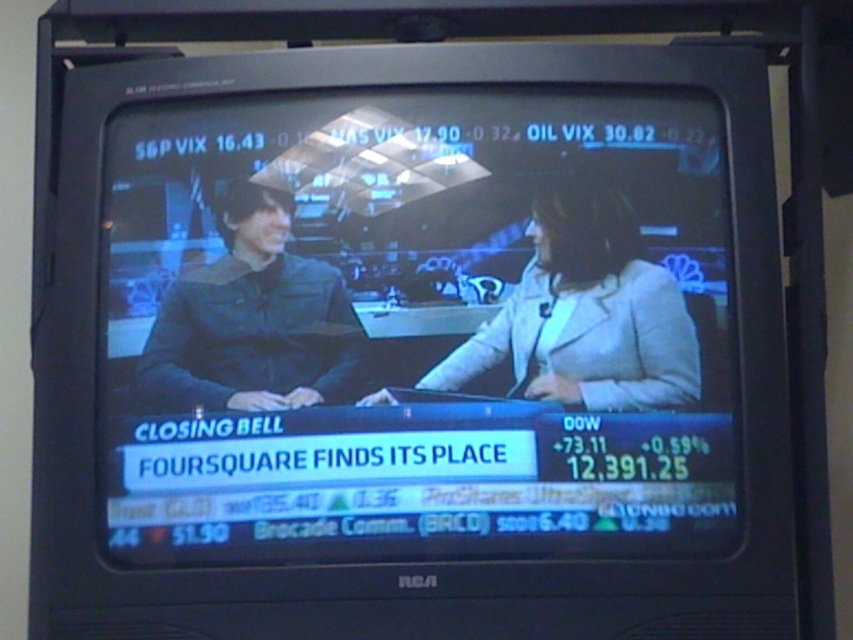
Question: Which of the following is the closest to the observer?

Choices:
 (A) light gray suit at center
 (B) matte black monitor at center

Answer: (B)

Question: Which object is closer to the camera taking this photo?

Choices:
 (A) light gray suit at center
 (B) matte black monitor at center

Answer: (B)

Question: Is matte black monitor at center above light gray suit at center?

Choices:
 (A) no
 (B) yes

Answer: (A)

Question: Which of the following is the farthest from the observer?

Choices:
 (A) (640, 172)
 (B) (622, 288)

Answer: (A)

Question: Is matte black monitor at center smaller than light gray suit at center?

Choices:
 (A) no
 (B) yes

Answer: (A)

Question: Does matte black monitor at center have a smaller size compared to light gray suit at center?

Choices:
 (A) no
 (B) yes

Answer: (A)